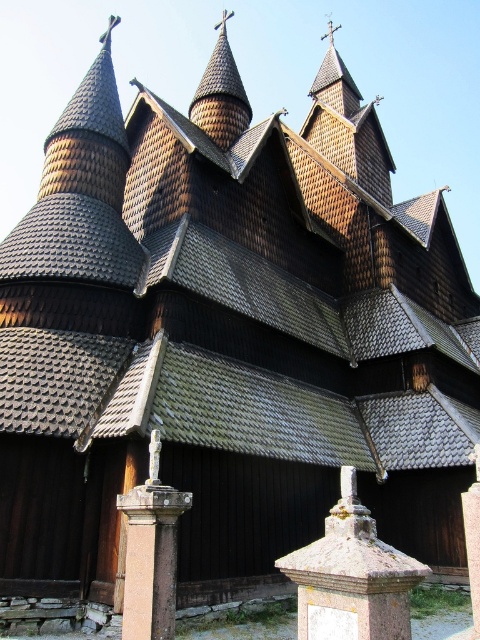
You are an architect examining the church. You notice the pink stone pillar at lower center and the dark brown wood spire at upper center. Which structure is larger in size?

The dark brown wood spire at upper center is larger than the pink stone pillar at lower center.